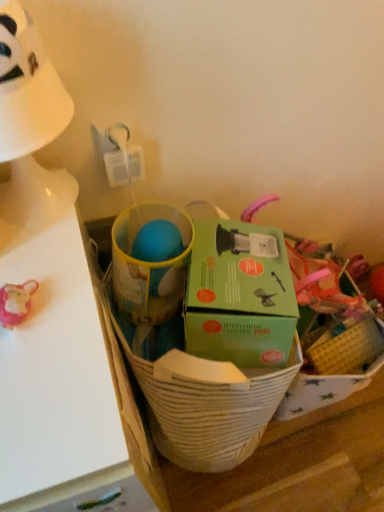
Question: Considering the relative sizes of green cardboard box at center and white matte table at left in the image provided, is green cardboard box at center wider than white matte table at left?

Choices:
 (A) no
 (B) yes

Answer: (A)

Question: From the image's perspective, is green cardboard box at center above white matte table at left?

Choices:
 (A) no
 (B) yes

Answer: (B)

Question: Is green cardboard box at center facing towards white matte table at left?

Choices:
 (A) no
 (B) yes

Answer: (A)

Question: Is green cardboard box at center directly adjacent to white matte table at left?

Choices:
 (A) yes
 (B) no

Answer: (B)

Question: Considering the relative sizes of green cardboard box at center and white matte table at left in the image provided, is green cardboard box at center thinner than white matte table at left?

Choices:
 (A) yes
 (B) no

Answer: (A)

Question: Is green cardboard box at center turned away from white matte table at left?

Choices:
 (A) yes
 (B) no

Answer: (B)

Question: Is green cardboard box at center positioned far away from white plastic table lamp at upper left?

Choices:
 (A) no
 (B) yes

Answer: (A)

Question: Considering the relative sizes of green cardboard box at center and white plastic table lamp at upper left in the image provided, is green cardboard box at center wider than white plastic table lamp at upper left?

Choices:
 (A) no
 (B) yes

Answer: (B)

Question: Is green cardboard box at center oriented towards white plastic table lamp at upper left?

Choices:
 (A) yes
 (B) no

Answer: (B)

Question: Considering the relative sizes of green cardboard box at center and white plastic table lamp at upper left in the image provided, is green cardboard box at center thinner than white plastic table lamp at upper left?

Choices:
 (A) no
 (B) yes

Answer: (A)

Question: From the image's perspective, does green cardboard box at center appear lower than white plastic table lamp at upper left?

Choices:
 (A) no
 (B) yes

Answer: (B)

Question: Considering the relative sizes of green cardboard box at center and white plastic table lamp at upper left in the image provided, is green cardboard box at center taller than white plastic table lamp at upper left?

Choices:
 (A) yes
 (B) no

Answer: (A)

Question: From the image's perspective, would you say white matte table at left is positioned over green cardboard box at center?

Choices:
 (A) yes
 (B) no

Answer: (B)